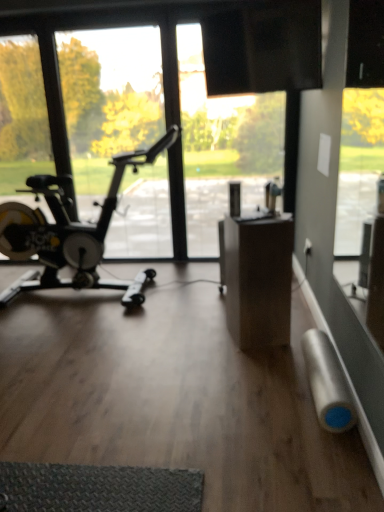
Question: Does silver matte duct tape at lower right have a lesser width compared to transparent glass window at left?

Choices:
 (A) no
 (B) yes

Answer: (A)

Question: Is silver matte duct tape at lower right bigger than transparent glass window at left?

Choices:
 (A) yes
 (B) no

Answer: (B)

Question: Is silver matte duct tape at lower right surrounding transparent glass window at left?

Choices:
 (A) no
 (B) yes

Answer: (A)

Question: Is silver matte duct tape at lower right not inside transparent glass window at left?

Choices:
 (A) yes
 (B) no

Answer: (A)

Question: From a real-world perspective, is silver matte duct tape at lower right below transparent glass window at left?

Choices:
 (A) yes
 (B) no

Answer: (A)

Question: Is silver matte duct tape at lower right not near transparent glass window at left?

Choices:
 (A) no
 (B) yes

Answer: (B)

Question: Is black matte stationary bicycle at left in front of silver matte duct tape at lower right?

Choices:
 (A) yes
 (B) no

Answer: (B)

Question: Is black matte stationary bicycle at left not near silver matte duct tape at lower right?

Choices:
 (A) no
 (B) yes

Answer: (B)

Question: From the image's perspective, is black matte stationary bicycle at left over silver matte duct tape at lower right?

Choices:
 (A) yes
 (B) no

Answer: (A)

Question: Can you confirm if black matte stationary bicycle at left is shorter than silver matte duct tape at lower right?

Choices:
 (A) no
 (B) yes

Answer: (A)

Question: Considering the relative sizes of black matte stationary bicycle at left and silver matte duct tape at lower right in the image provided, is black matte stationary bicycle at left thinner than silver matte duct tape at lower right?

Choices:
 (A) no
 (B) yes

Answer: (A)

Question: Does black matte stationary bicycle at left have a smaller size compared to silver matte duct tape at lower right?

Choices:
 (A) no
 (B) yes

Answer: (A)

Question: Considering the relative sizes of transparent glass window at left and silver matte duct tape at lower right in the image provided, is transparent glass window at left shorter than silver matte duct tape at lower right?

Choices:
 (A) no
 (B) yes

Answer: (A)